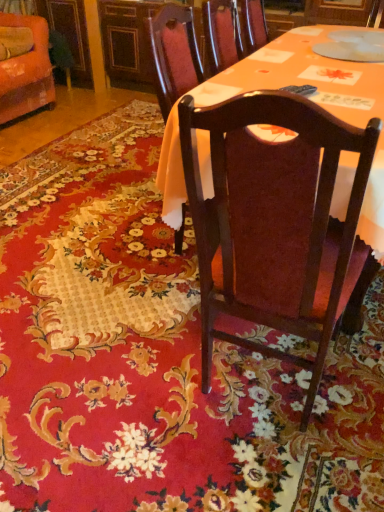
In order to face dark wood chair at center, acting as the second chair starting from the left, should I rotate leftwards or rightwards?

It's best to rotate right around 12.152 degrees.

Identify the location of dark wood chair at center, which is counted as the 1th chair, starting from the bottom. (278, 223).

What do you see at coordinates (26, 72) in the screenshot? I see `orange fabric chair at upper left, which ranks as the 2th chair in right-to-left order` at bounding box center [26, 72].

At what (x,y) coordinates should I click in order to perform the action: click on orange fabric chair at upper left, which is the 1th chair in left-to-right order. Please return your answer as a coordinate pair (x, y). This screenshot has height=512, width=384. Looking at the image, I should click on (26, 72).

Find the location of a particular element. The width and height of the screenshot is (384, 512). dark wood chair at center, the second chair from the top is located at coordinates (278, 223).

From the picture: Is dark wood chair at center, the 1th chair positioned from the front, in contact with orange fabric chair at upper left, which ranks as the 2th chair in right-to-left order?

No, dark wood chair at center, the 1th chair positioned from the front, is not beside orange fabric chair at upper left, which ranks as the 2th chair in right-to-left order.

Considering the relative positions of dark wood chair at center, which is counted as the 1th chair, starting from the bottom, and orange fabric chair at upper left, acting as the second chair starting from the bottom, in the image provided, is dark wood chair at center, which is counted as the 1th chair, starting from the bottom, to the left of orange fabric chair at upper left, acting as the second chair starting from the bottom, from the viewer's perspective?

No.

From the image's perspective, is dark wood chair at center, acting as the second chair starting from the left, located beneath orange fabric chair at upper left, which is the 1th chair in left-to-right order?

Correct, dark wood chair at center, acting as the second chair starting from the left, appears lower than orange fabric chair at upper left, which is the 1th chair in left-to-right order, in the image.

Choose the correct answer: Is dark wood chair at center, the 1th chair positioned from the front, inside orange fabric chair at upper left, acting as the second chair starting from the bottom, or outside it?

dark wood chair at center, the 1th chair positioned from the front, is not enclosed by orange fabric chair at upper left, acting as the second chair starting from the bottom.

Does dark wood chair at center, marked as the 1th chair in a right-to-left arrangement, contain matte wood table at center?

Definitely not — matte wood table at center is not inside dark wood chair at center, marked as the 1th chair in a right-to-left arrangement.

Between dark wood chair at center, the second chair from the top, and matte wood table at center, which one has less height?

Standing shorter between the two is matte wood table at center.

In the scene shown: Is dark wood chair at center, the second chair from the top, positioned with its back to matte wood table at center?

No.

In the scene shown: Is dark wood chair at center, the 1th chair positioned from the front, smaller than matte wood table at center?

Incorrect, dark wood chair at center, the 1th chair positioned from the front, is not smaller in size than matte wood table at center.

Who is taller, orange fabric chair at upper left, which ranks as the 2th chair in right-to-left order, or matte wood table at center?

With more height is matte wood table at center.

Find the location of a particular element. Image resolution: width=384 pixels, height=512 pixels. desk lying in front of the orange fabric chair at upper left, which is the 1th chair in left-to-right order is located at coordinates (316, 100).

In the image, is orange fabric chair at upper left, which ranks as the 2th chair in right-to-left order, positioned in front of or behind matte wood table at center?

Visually, orange fabric chair at upper left, which ranks as the 2th chair in right-to-left order, is located behind matte wood table at center.

Does orange fabric chair at upper left, acting as the second chair starting from the bottom, touch matte wood table at center?

No, orange fabric chair at upper left, acting as the second chair starting from the bottom, is not beside matte wood table at center.

Can you confirm if matte wood table at center is positioned to the right of orange fabric chair at upper left, acting as the second chair starting from the bottom?

Indeed, matte wood table at center is positioned on the right side of orange fabric chair at upper left, acting as the second chair starting from the bottom.

Can you see matte wood table at center touching orange fabric chair at upper left, which is the 1th chair from back to front?

No, matte wood table at center is not in contact with orange fabric chair at upper left, which is the 1th chair from back to front.

Looking at this image, which is less distant, (345, 194) or (46, 99)?

Clearly, point (345, 194) is closer to the camera than point (46, 99).

Measure the distance from matte wood table at center to orange fabric chair at upper left, acting as the second chair starting from the bottom.

A distance of 2.02 meters exists between matte wood table at center and orange fabric chair at upper left, acting as the second chair starting from the bottom.

From their relative heights in the image, would you say matte wood table at center is taller or shorter than dark wood chair at center, marked as the 1th chair in a right-to-left arrangement?

Considering their sizes, matte wood table at center has less height than dark wood chair at center, marked as the 1th chair in a right-to-left arrangement.

In terms of width, does matte wood table at center look wider or thinner when compared to dark wood chair at center, the second chair from the top?

Considering their sizes, matte wood table at center looks slimmer than dark wood chair at center, the second chair from the top.

Considering the sizes of objects matte wood table at center and dark wood chair at center, acting as the second chair starting from the left, in the image provided, who is bigger, matte wood table at center or dark wood chair at center, acting as the second chair starting from the left,?

Bigger between the two is dark wood chair at center, acting as the second chair starting from the left.

Which point is more distant from viewer, (265, 81) or (325, 244)?

The point (265, 81) is farther.

Which of these two, orange fabric chair at upper left, which appears as the 1th chair when viewed from the top, or dark wood chair at center, which is counted as the 1th chair, starting from the bottom, is bigger?

dark wood chair at center, which is counted as the 1th chair, starting from the bottom.

Considering the relative positions of orange fabric chair at upper left, which is the 1th chair in left-to-right order, and dark wood chair at center, the second chair from the top, in the image provided, is orange fabric chair at upper left, which is the 1th chair in left-to-right order, to the right of dark wood chair at center, the second chair from the top, from the viewer's perspective?

Incorrect, orange fabric chair at upper left, which is the 1th chair in left-to-right order, is not on the right side of dark wood chair at center, the second chair from the top.

Could you tell me if orange fabric chair at upper left, which ranks as the 2th chair in right-to-left order, is facing dark wood chair at center, marked as the 2th chair in a back-to-front arrangement?

No, orange fabric chair at upper left, which ranks as the 2th chair in right-to-left order, is not aimed at dark wood chair at center, marked as the 2th chair in a back-to-front arrangement.

How distant is orange fabric chair at upper left, which is the 1th chair in left-to-right order, from dark wood chair at center, marked as the 1th chair in a right-to-left arrangement?

The distance of orange fabric chair at upper left, which is the 1th chair in left-to-right order, from dark wood chair at center, marked as the 1th chair in a right-to-left arrangement, is 8.62 feet.

Find the location of a particular element. The width and height of the screenshot is (384, 512). chair in front of the orange fabric chair at upper left, which ranks as the 2th chair in right-to-left order is located at coordinates (278, 223).

Where is `chair to the right of matte wood table at center`? This screenshot has width=384, height=512. chair to the right of matte wood table at center is located at coordinates (x=278, y=223).

Consider the image. Which object lies further to the anchor point orange fabric chair at upper left, acting as the second chair starting from the bottom, matte wood table at center or dark wood chair at center, the 1th chair positioned from the front?

Among the two, dark wood chair at center, the 1th chair positioned from the front, is located further to orange fabric chair at upper left, acting as the second chair starting from the bottom.

From the picture: Which object lies nearer to the anchor point orange fabric chair at upper left, which appears as the 1th chair when viewed from the top, dark wood chair at center, which is counted as the 1th chair, starting from the bottom, or matte wood table at center?

Based on the image, matte wood table at center appears to be nearer to orange fabric chair at upper left, which appears as the 1th chair when viewed from the top.

From the picture: Based on their spatial positions, is orange fabric chair at upper left, which appears as the 1th chair when viewed from the top, or matte wood table at center further from dark wood chair at center, the 1th chair positioned from the front?

Among the two, orange fabric chair at upper left, which appears as the 1th chair when viewed from the top, is located further to dark wood chair at center, the 1th chair positioned from the front.

Which object lies further to the anchor point matte wood table at center, orange fabric chair at upper left, which is the 1th chair from back to front, or dark wood chair at center, marked as the 2th chair in a back-to-front arrangement?

orange fabric chair at upper left, which is the 1th chair from back to front, is further to matte wood table at center.

From the image, which object appears to be nearer to matte wood table at center, dark wood chair at center, the 1th chair positioned from the front, or orange fabric chair at upper left, which is the 1th chair from back to front?

Based on the image, dark wood chair at center, the 1th chair positioned from the front, appears to be nearer to matte wood table at center.

Considering their positions, is matte wood table at center positioned further to dark wood chair at center, the second chair from the top, than orange fabric chair at upper left, which is the 1th chair from back to front?

orange fabric chair at upper left, which is the 1th chair from back to front, is further to dark wood chair at center, the second chair from the top.

Locate an element on the screen. The height and width of the screenshot is (512, 384). desk located between dark wood chair at center, marked as the 1th chair in a right-to-left arrangement, and orange fabric chair at upper left, which is the 1th chair from back to front, in the depth direction is located at coordinates (316, 100).